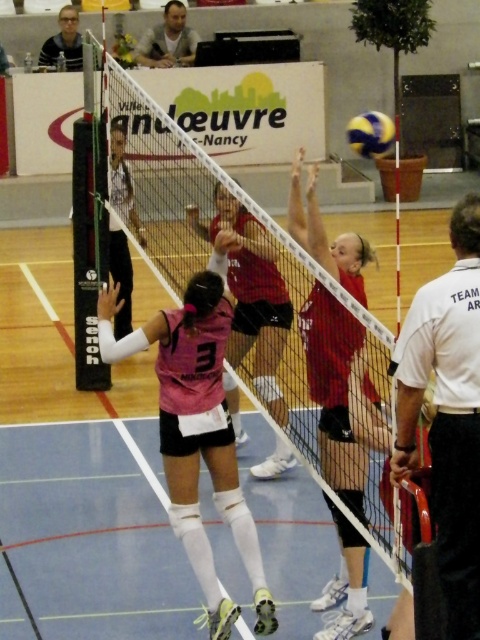
You are a referee watching the volleyball match. You need to determine if the white shirt at right and the red jersey at center are on the same team. Can you confirm this based on their positions?

The white shirt at right is positioned on the right side of red jersey at center, which suggests they are aligned on the same side of the court. Since teammates typically position themselves on the same side during a volleyball match, they are likely on the same team.